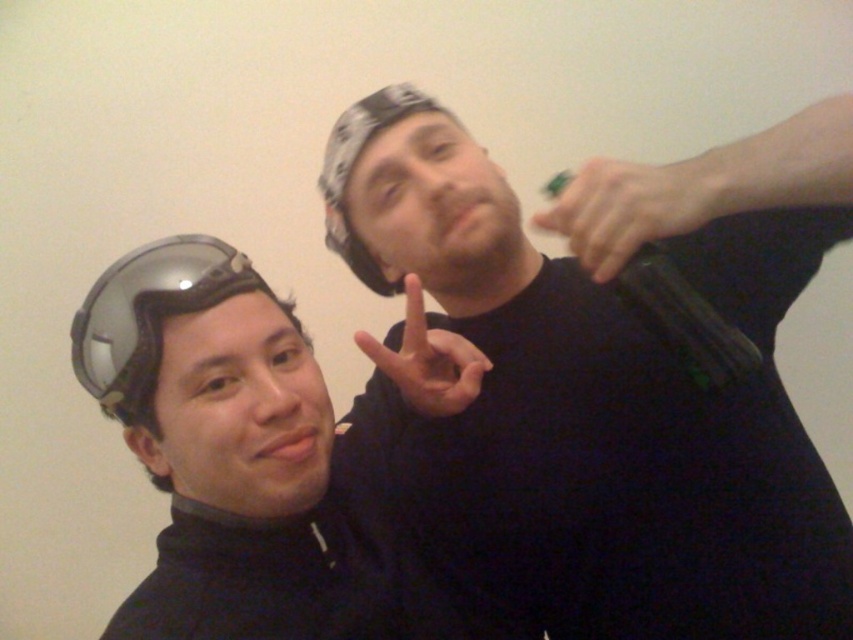
Is point (566, 225) positioned in front of point (602, 220)?

No, (566, 225) is behind (602, 220).

Can you confirm if green matte hand at upper right is thinner than green matte toy at upper center?

Incorrect, green matte hand at upper right's width is not less than green matte toy at upper center's.

Image resolution: width=853 pixels, height=640 pixels. What do you see at coordinates (704, 186) in the screenshot?
I see `green matte hand at upper right` at bounding box center [704, 186].

The image size is (853, 640). I want to click on green matte hand at upper right, so click(704, 186).

Between black matte shirt at upper right and transparent plastic goggles at left, which one is positioned lower?

transparent plastic goggles at left is below.

Is black matte shirt at upper right above transparent plastic goggles at left?

Yes, black matte shirt at upper right is above transparent plastic goggles at left.

The image size is (853, 640). What are the coordinates of `black matte shirt at upper right` in the screenshot? It's located at (608, 380).

At what (x,y) coordinates should I click in order to perform the action: click on black matte shirt at upper right. Please return your answer as a coordinate pair (x, y). Image resolution: width=853 pixels, height=640 pixels. Looking at the image, I should click on (608, 380).

Who is more forward, [257,522] or [451,387]?

Point [257,522] is more forward.

Locate an element on the screen. Image resolution: width=853 pixels, height=640 pixels. matte black helmet at left is located at coordinates (262, 452).

Which is in front, point (177, 369) or point (434, 412)?

Positioned in front is point (177, 369).

Locate an element on the screen. The image size is (853, 640). matte black helmet at left is located at coordinates (262, 452).